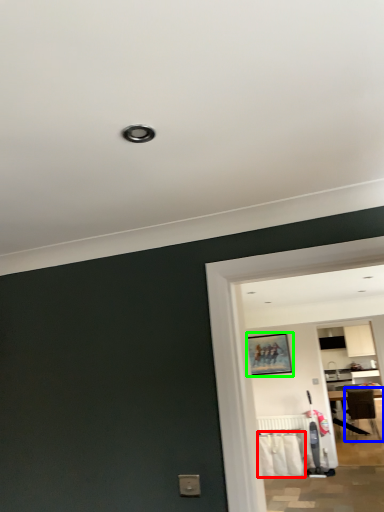
Question: Based on their relative distances, which object is nearer to laundry (highlighted by a red box)? Choose from chair (highlighted by a blue box) and picture frame (highlighted by a green box).

Choices:
 (A) chair
 (B) picture frame

Answer: (B)